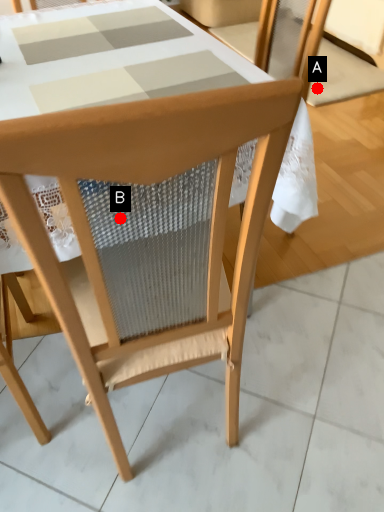
Question: Two points are circled on the image, labeled by A and B beside each circle. Among these points, which one is farthest from the camera?

Choices:
 (A) A is further
 (B) B is further

Answer: (A)